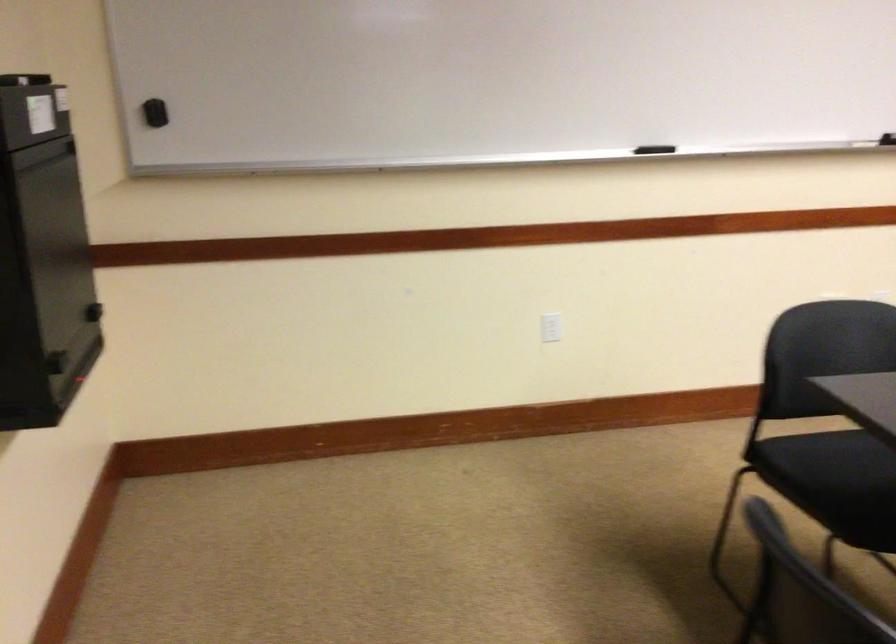
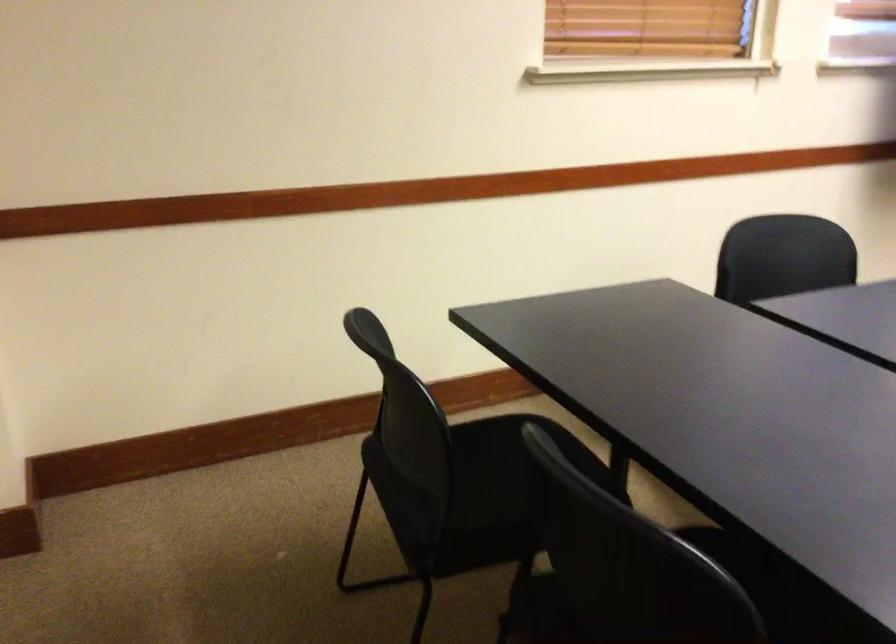
Question: What movement of the cameraman would produce the second image?

Choices:
 (A) Left
 (B) Right
 (C) Forward
 (D) Backward

Answer: (D)